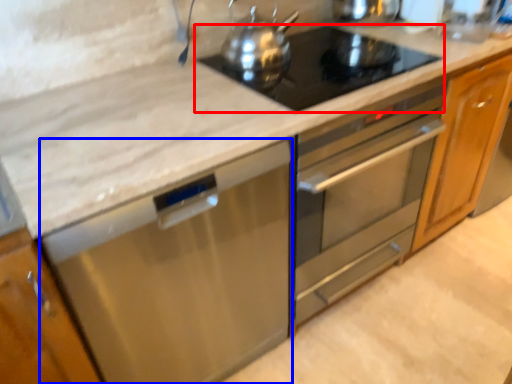
Question: Among these objects, which one is nearest to the camera, gas stove (highlighted by a red box) or dish washer (highlighted by a blue box)?

Choices:
 (A) gas stove
 (B) dish washer

Answer: (B)